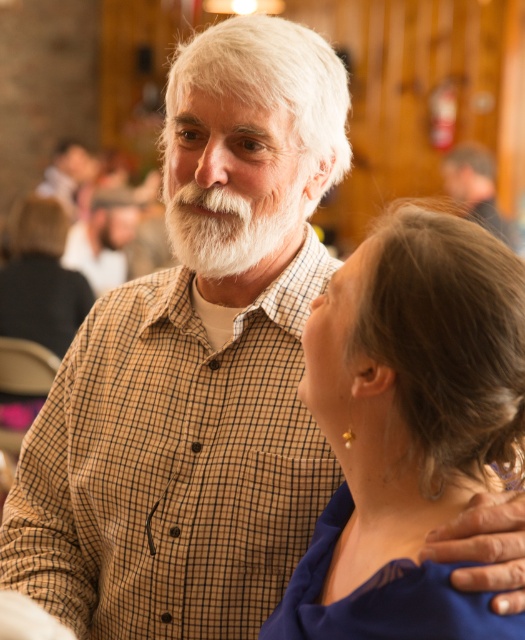
Question: Which object is the farthest from the white fluffy beard at center?

Choices:
 (A) brown plaid shirt at upper right
 (B) blue satin blouse at center
 (C) matte brown shirt at upper center

Answer: (A)

Question: Estimate the real-world distances between objects in this image. Which object is farther from the matte brown shirt at upper left?

Choices:
 (A) matte brown shirt at upper center
 (B) white fluffy beard at center
 (C) brown plaid shirt at upper right
 (D) blue satin blouse at center

Answer: (D)

Question: Among these objects, which one is farthest from the camera?

Choices:
 (A) blue satin blouse at center
 (B) matte brown shirt at upper center
 (C) brown plaid shirt at upper right

Answer: (C)

Question: Where is white fluffy beard at center located in relation to matte brown shirt at upper center in the image?

Choices:
 (A) right
 (B) left

Answer: (A)

Question: Where is blue satin blouse at center located in relation to brown plaid shirt at upper right in the image?

Choices:
 (A) right
 (B) left

Answer: (B)

Question: Is the position of blue satin blouse at center less distant than that of matte brown shirt at upper center?

Choices:
 (A) no
 (B) yes

Answer: (B)